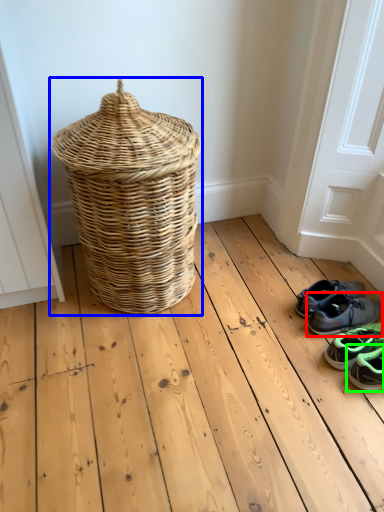
Question: Which object is the farthest from footwear (highlighted by a red box)? Choose among these: picnic basket (highlighted by a blue box) or footwear (highlighted by a green box).

Choices:
 (A) picnic basket
 (B) footwear

Answer: (A)